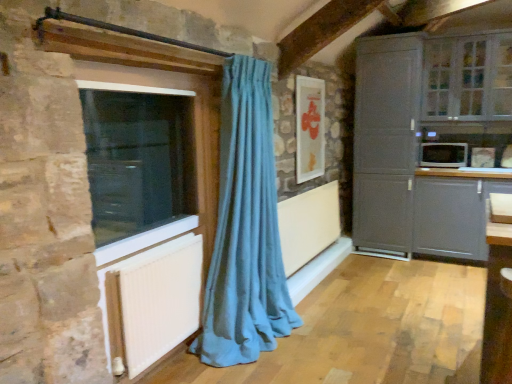
This screenshot has width=512, height=384. I want to click on free space in front of matte gray cabinet at lower right, so click(456, 279).